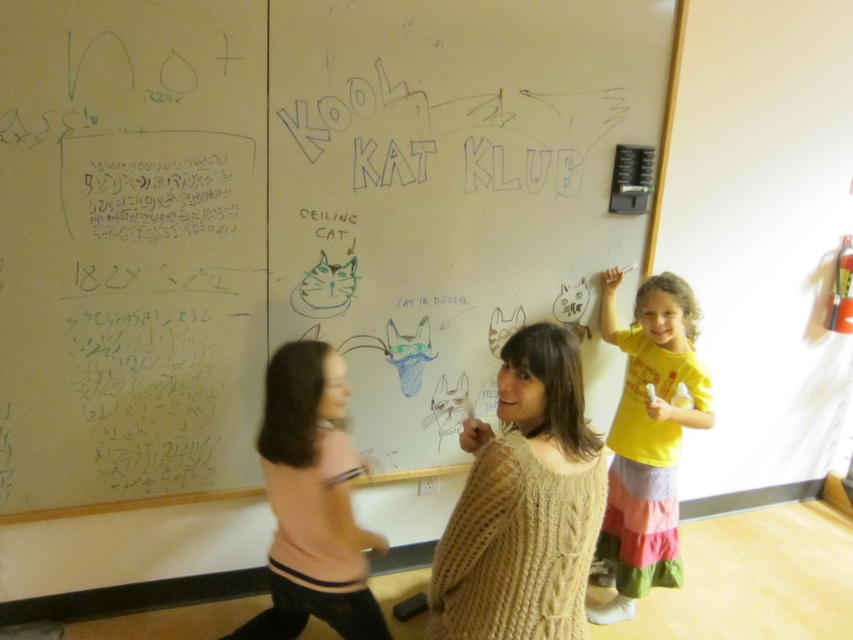
Is pink fabric shirt at lower left smaller than yellow cotton shirt at upper right?

Yes.

Who is more distant from viewer, [363,600] or [625,500]?

Point [625,500]

Which is behind, point (328, 608) or point (660, 428)?

The point (660, 428) is behind.

Where is `pink fabric shirt at lower left`? pink fabric shirt at lower left is located at coordinates (312, 500).

Is point (199, 177) positioned behind point (706, 419)?

No, (199, 177) is in front of (706, 419).

Is whiteboard at center below yellow cotton shirt at upper right?

No, whiteboard at center is not below yellow cotton shirt at upper right.

Describe the element at coordinates (300, 220) in the screenshot. I see `whiteboard at center` at that location.

You are a GUI agent. You are given a task and a screenshot of the screen. Output one action in this format:
    pyautogui.click(x=<x>, y=<y>)
    Task: Click on the whiteboard at center
    This screenshot has height=640, width=853.
    Given the screenshot: What is the action you would take?
    pyautogui.click(x=300, y=220)

Can you confirm if cable-knit sweater at center is taller than pink fabric shirt at lower left?

No, cable-knit sweater at center is not taller than pink fabric shirt at lower left.

Locate an element on the screen. The width and height of the screenshot is (853, 640). cable-knit sweater at center is located at coordinates (523, 504).